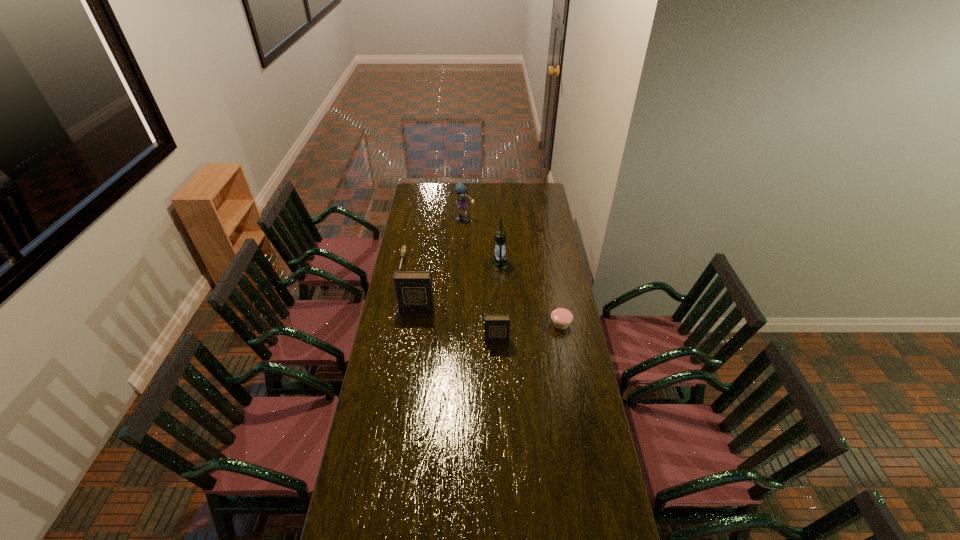
Where is `empty space that is in between the nearer diary and the rag doll`? empty space that is in between the nearer diary and the rag doll is located at coordinates (481, 280).

I want to click on free spot between the farther diary and the lantern, so click(458, 286).

Locate an element on the screen. empty location between the lantern and the farthest object is located at coordinates (482, 242).

Where is `vacant point located between the cupcake and the tallest object`? This screenshot has width=960, height=540. vacant point located between the cupcake and the tallest object is located at coordinates (530, 294).

Find the location of a particular element. Image resolution: width=960 pixels, height=540 pixels. empty space that is in between the nearer diary and the screwdriver is located at coordinates (449, 300).

You are a GUI agent. You are given a task and a screenshot of the screen. Output one action in this format:
    pyautogui.click(x=<x>, y=<y>)
    Task: Click on the free space between the second shortest object and the lantern
    
    Given the screenshot: What is the action you would take?
    pyautogui.click(x=530, y=294)

Identify which object is located as the third nearest to the lantern. Please provide its 2D coordinates. Your answer should be formatted as a tuple, i.e. [(x, y)], where the tuple contains the x and y coordinates of a point satisfying the conditions above.

[(414, 290)]

Identify which object is the fifth nearest to the shortest object. Please provide its 2D coordinates. Your answer should be formatted as a tuple, i.e. [(x, y)], where the tuple contains the x and y coordinates of a point satisfying the conditions above.

[(561, 318)]

I want to click on vacant area in the image that satisfies the following two spatial constraints: 1. on the side where the lantern emits light; 2. on the front cover of the fourth shortest object, so click(x=502, y=309).

The height and width of the screenshot is (540, 960). Find the location of `free space in the image that satisfies the following two spatial constraints: 1. on the front cover of the fourth farthest object; 2. on the right side of the fifth farthest object`. free space in the image that satisfies the following two spatial constraints: 1. on the front cover of the fourth farthest object; 2. on the right side of the fifth farthest object is located at coordinates (414, 323).